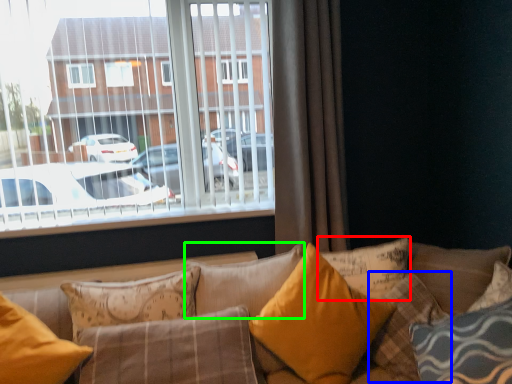
Question: Estimate the real-world distances between objects in this image. Which object is farther from pillow (highlighted by a red box), pillow (highlighted by a blue box) or pillow (highlighted by a green box)?

Choices:
 (A) pillow
 (B) pillow

Answer: (B)